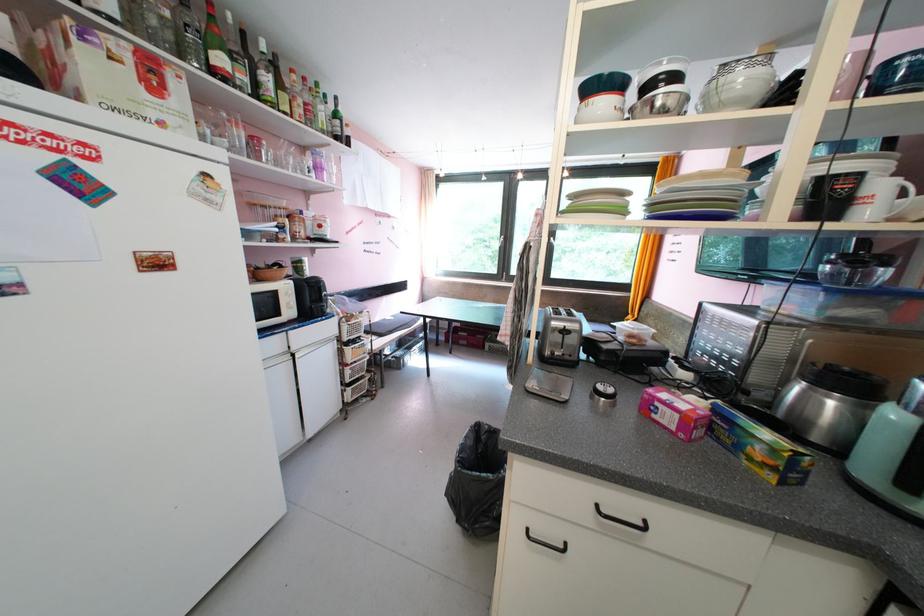
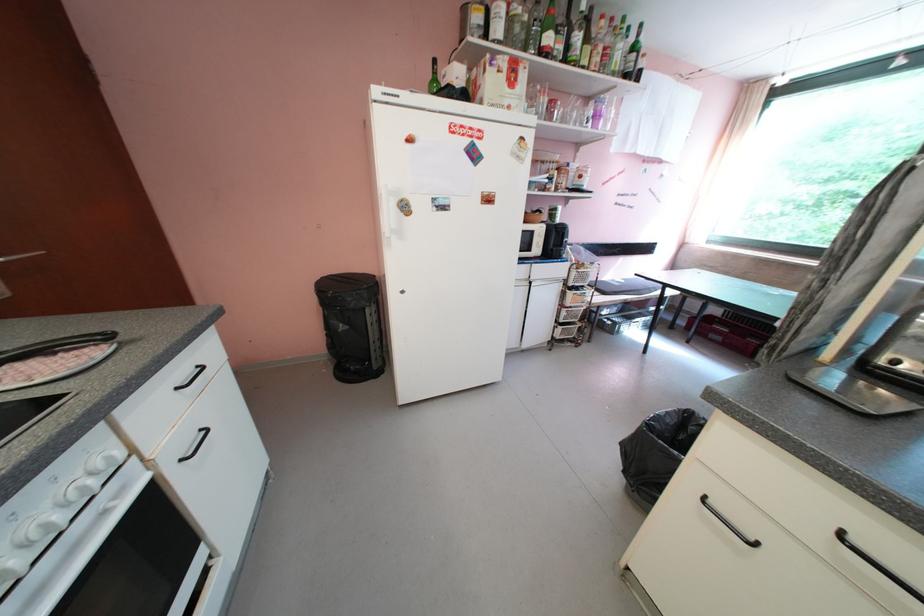
Find the pixel in the second image that matches [286,164] in the first image.

(572, 122)